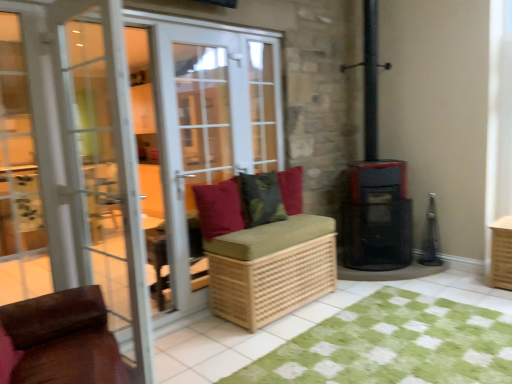
The height and width of the screenshot is (384, 512). Identify the location of free space above matte white screen door at center, which is counted as the 2th screen door, starting from the front (from a real-world perspective). (194, 23).